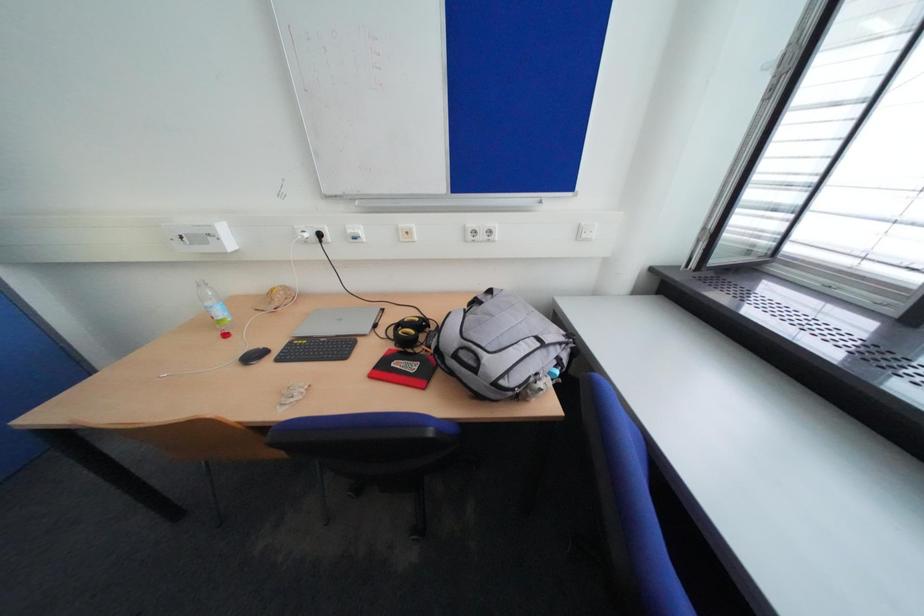
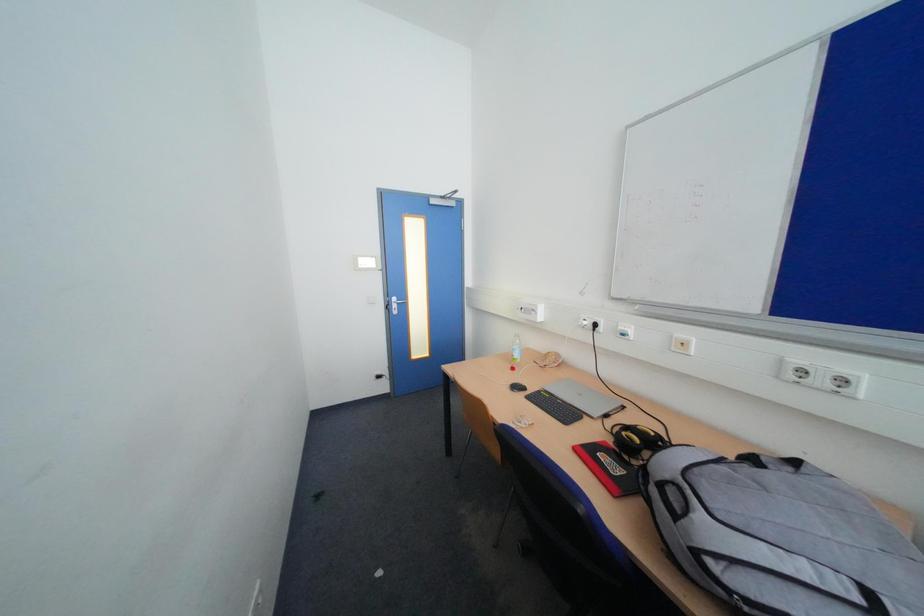
Question: The first image is from the beginning of the video and the second image is from the end. How did the camera likely rotate when shooting the video?

Choices:
 (A) Left
 (B) Right
 (C) Up
 (D) Down

Answer: (A)